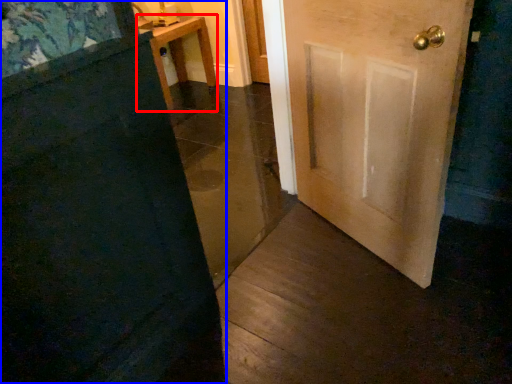
Question: Which point is closer to the camera, furniture (highlighted by a red box) or door (highlighted by a blue box)?

Choices:
 (A) furniture
 (B) door

Answer: (B)